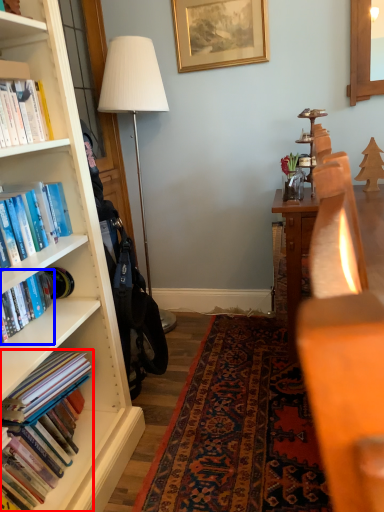
Question: Which of the following is the closest to the observer, book (highlighted by a red box) or book (highlighted by a blue box)?

Choices:
 (A) book
 (B) book

Answer: (A)